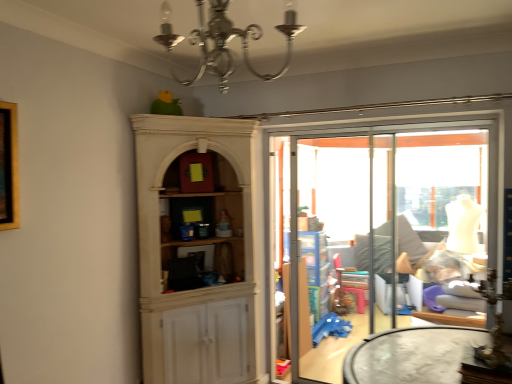
The width and height of the screenshot is (512, 384). In order to click on vacant area on top of transparent glass window at center (from a real-world perspective) in this screenshot , I will do `click(428, 130)`.